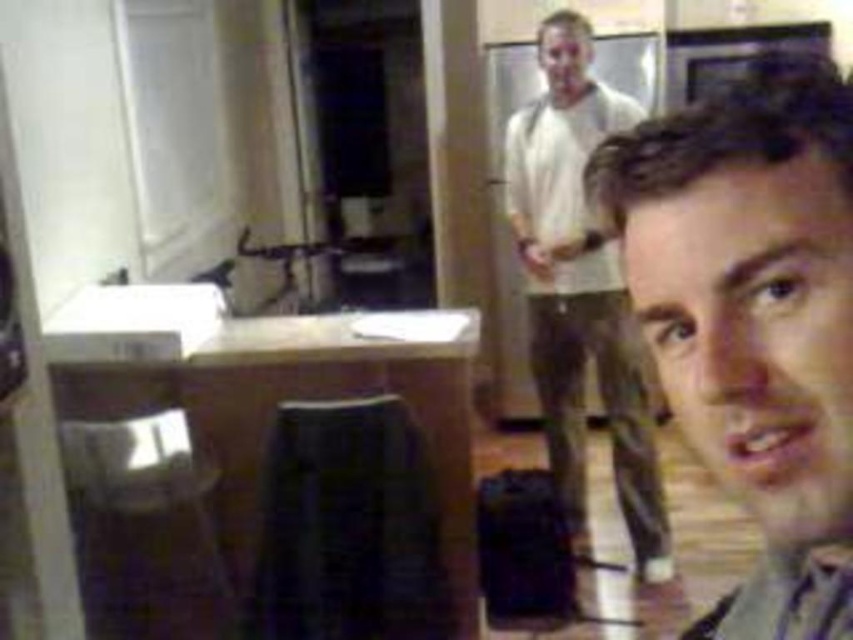
Question: Is white cotton shirt at upper center bigger than metallic silver stool at lower left?

Choices:
 (A) yes
 (B) no

Answer: (A)

Question: Which object is the closest to the white cotton shirt at upper center?

Choices:
 (A) light brown hair at center
 (B) metallic silver stool at lower left

Answer: (B)

Question: From the image, what is the correct spatial relationship of light brown hair at center in relation to metallic silver stool at lower left?

Choices:
 (A) left
 (B) right

Answer: (B)

Question: Is white cotton shirt at upper center below metallic silver stool at lower left?

Choices:
 (A) no
 (B) yes

Answer: (A)

Question: Which is farther from the metallic silver stool at lower left?

Choices:
 (A) white cotton shirt at upper center
 (B) light brown hair at center

Answer: (B)

Question: Considering the real-world distances, which object is farthest from the metallic silver stool at lower left?

Choices:
 (A) light brown hair at center
 (B) white cotton shirt at upper center

Answer: (A)